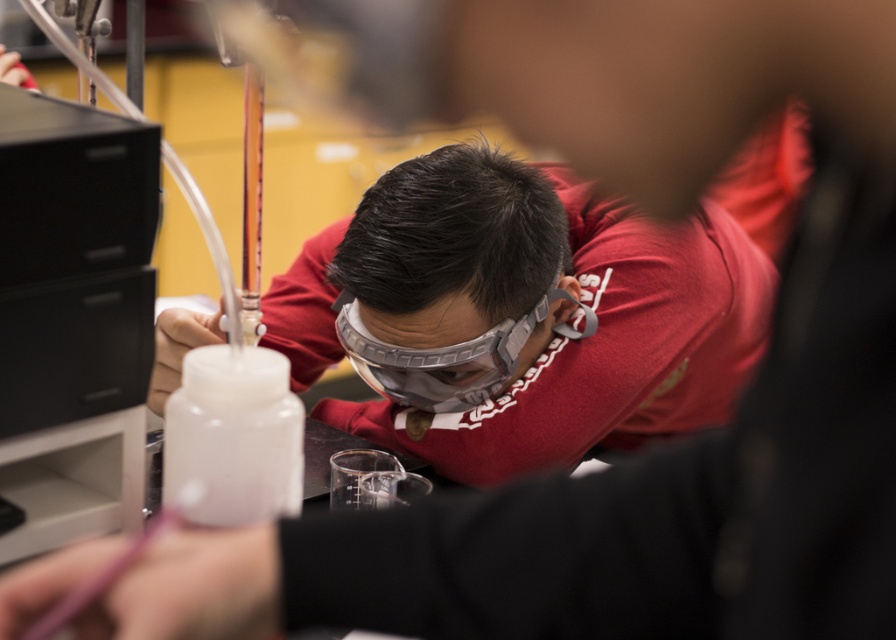
Which is below, matte gray safety goggles at center or gray matte goggles at center?

gray matte goggles at center is below.

Is matte gray safety goggles at center to the left of gray matte goggles at center from the viewer's perspective?

No, matte gray safety goggles at center is not to the left of gray matte goggles at center.

Locate an element on the screen. matte gray safety goggles at center is located at coordinates (607, 348).